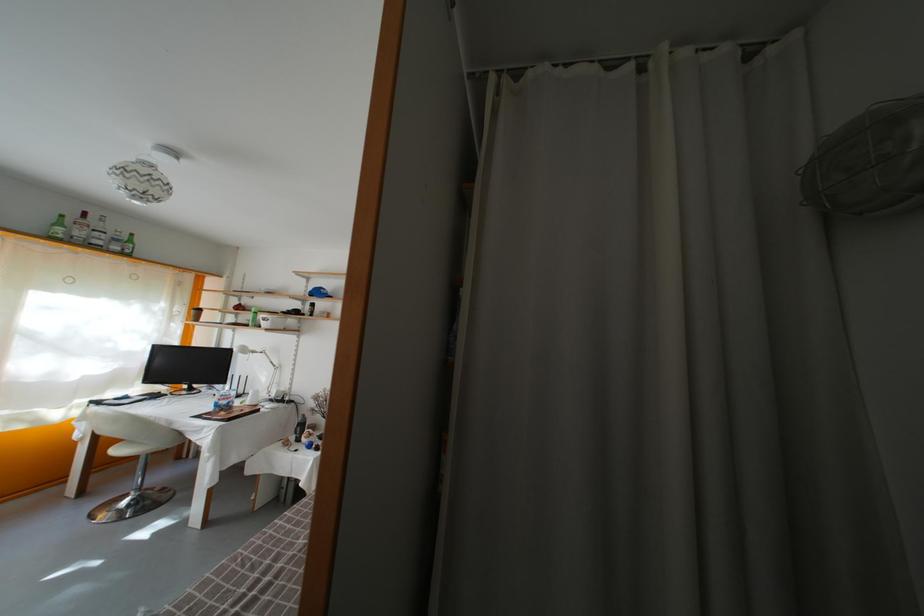
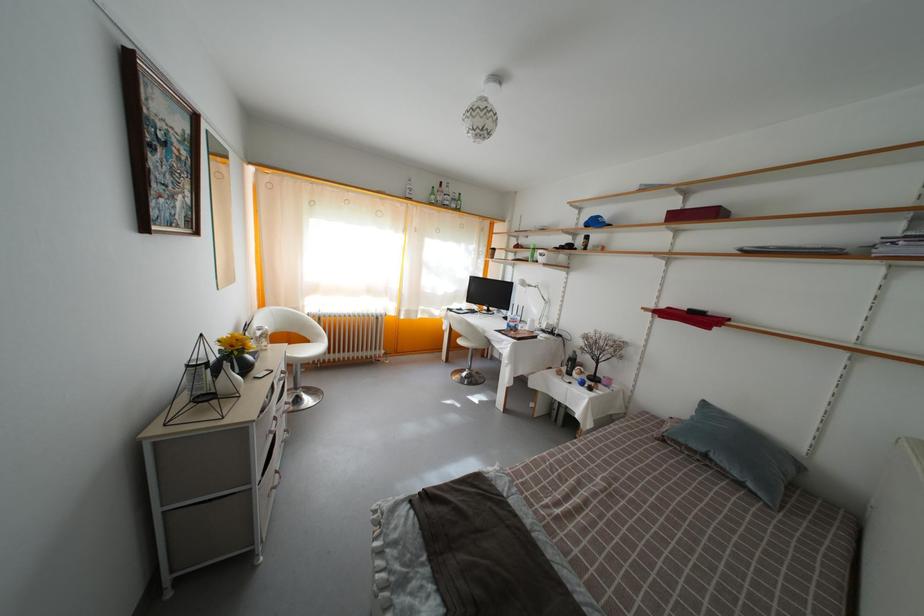
Question: Based on the continuous images, in which direction is the camera rotating? Reply with the corresponding letter.

Choices:
 (A) Left
 (B) Right
 (C) Up
 (D) Down

Answer: (A)